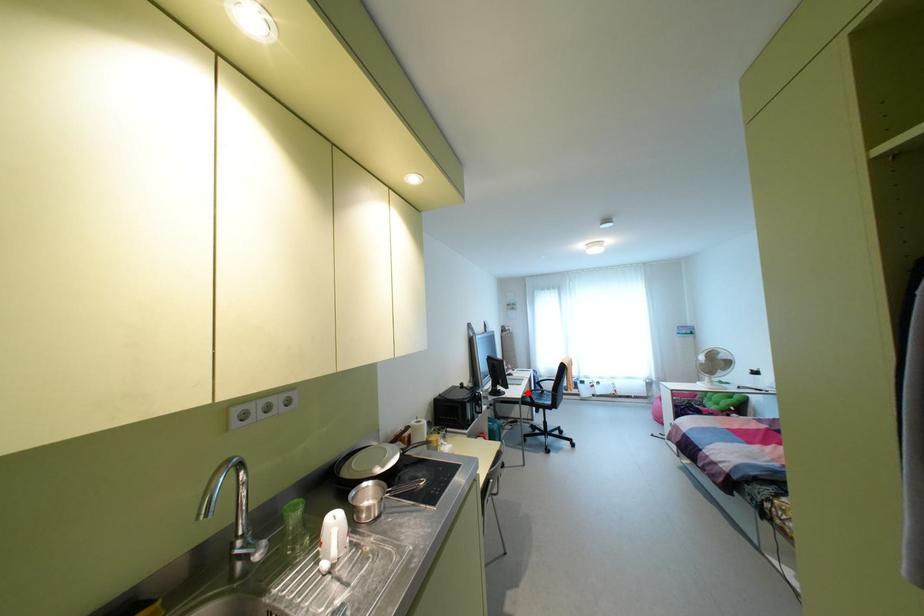
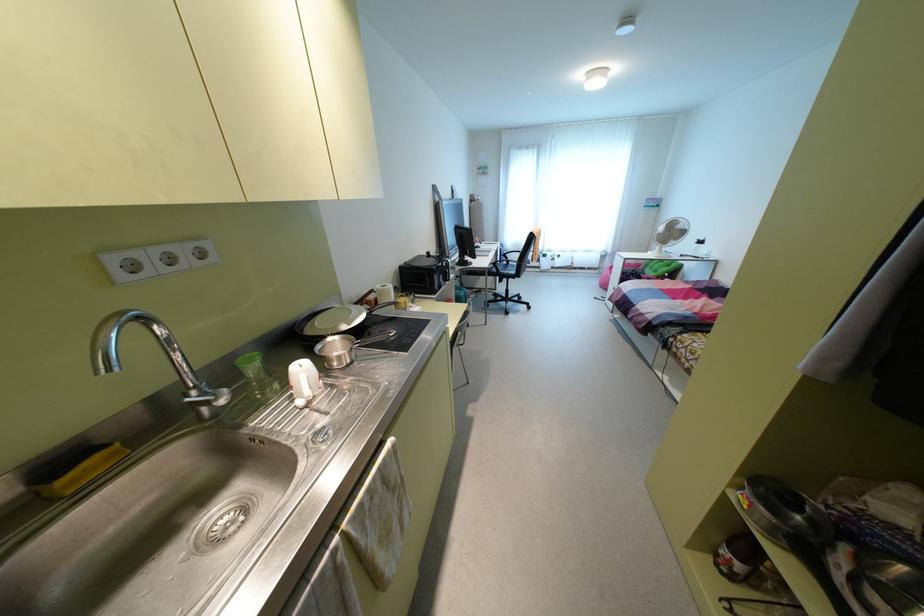
In the second image, find the point that corresponds to the highlighted location in the first image.

(493, 262)